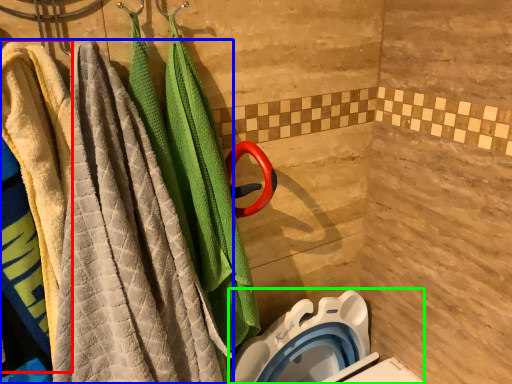
Question: Which object is positioned farthest from beach towel (highlighted by a red box)? Select from towel (highlighted by a blue box) and toilet bowl (highlighted by a green box).

Choices:
 (A) towel
 (B) toilet bowl

Answer: (B)